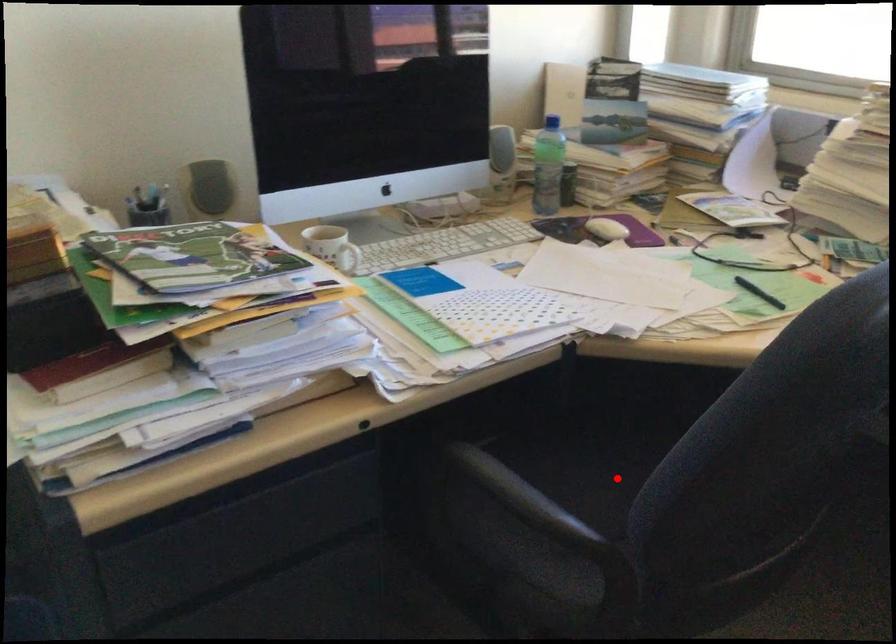
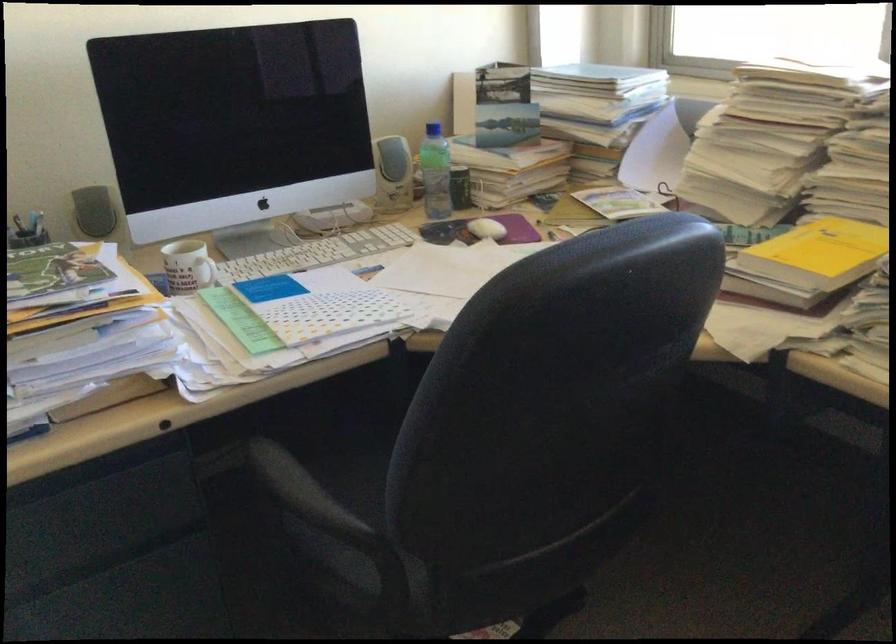
Question: I am providing you with two images of the same scene from different viewpoints. A red point is marked on the first image. At the location where the point appears in image 1, is it still visible in image 2?

Choices:
 (A) Yes
 (B) No

Answer: (B)